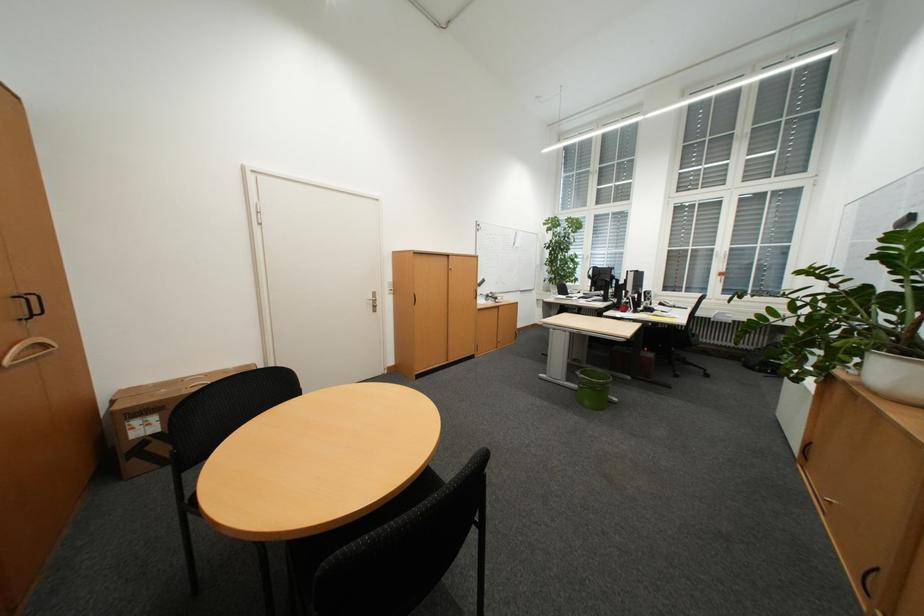
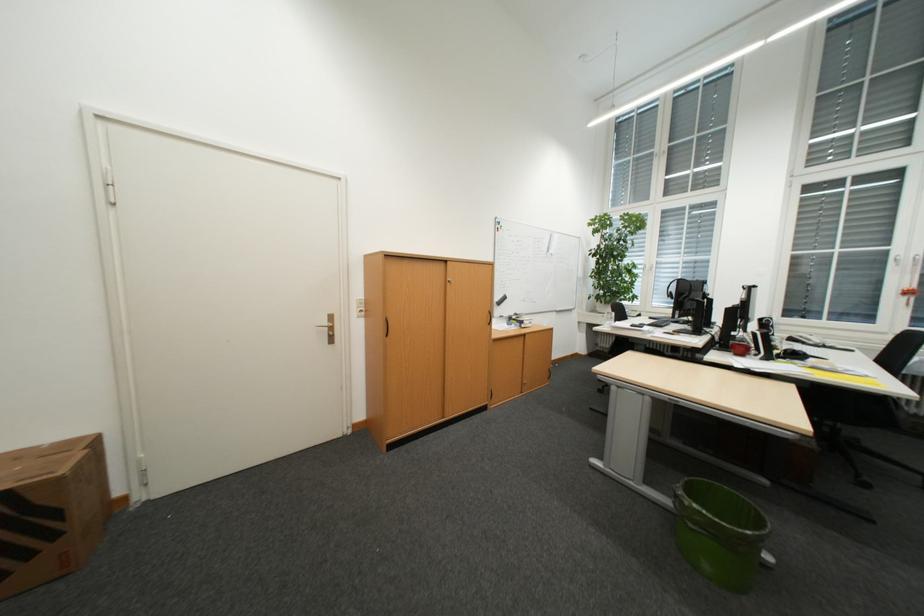
Question: Which direction would the cameraman need to move to produce the second image? Reply with the corresponding letter.

Choices:
 (A) Left
 (B) Right
 (C) Forward
 (D) Backward

Answer: (C)